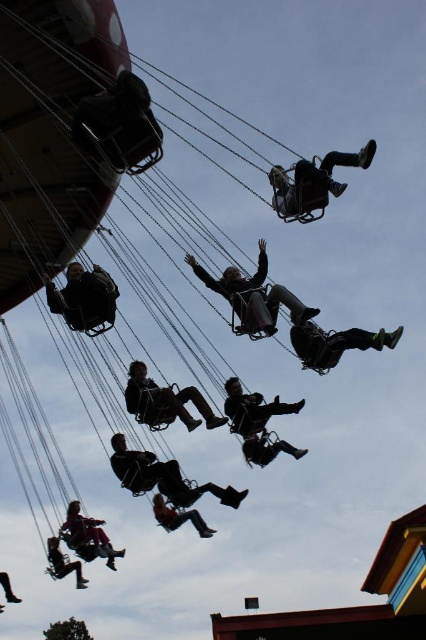
Can you confirm if matte black jacket at center is wider than orange fabric swing at center?

Yes, matte black jacket at center is wider than orange fabric swing at center.

Is matte black jacket at center below orange fabric swing at center?

No.

This screenshot has height=640, width=426. What are the coordinates of `matte black jacket at center` in the screenshot? It's located at (253, 296).

Locate an element on the screen. This screenshot has width=426, height=640. matte black helmet at upper center is located at coordinates (313, 180).

Is point (313, 177) farther from viewer compared to point (192, 515)?

No, (313, 177) is in front of (192, 515).

You are a GUI agent. You are given a task and a screenshot of the screen. Output one action in this format:
    pyautogui.click(x=<x>, y=<y>)
    Task: Click on the matte black helmet at upper center
    
    Given the screenshot: What is the action you would take?
    pyautogui.click(x=313, y=180)

Does point (316, 339) come behind point (83, 582)?

No, it is in front of (83, 582).

Who is positioned more to the right, dark gray fabric swing at lower right or matte black person at lower left?

dark gray fabric swing at lower right is more to the right.

Measure the distance between point (325, 346) and camera.

Point (325, 346) is 109.79 feet away from camera.

You are a GUI agent. You are given a task and a screenshot of the screen. Output one action in this format:
    pyautogui.click(x=<x>, y=<y>)
    Task: Click on the dark gray fabric swing at lower right
    
    Given the screenshot: What is the action you would take?
    pyautogui.click(x=334, y=342)